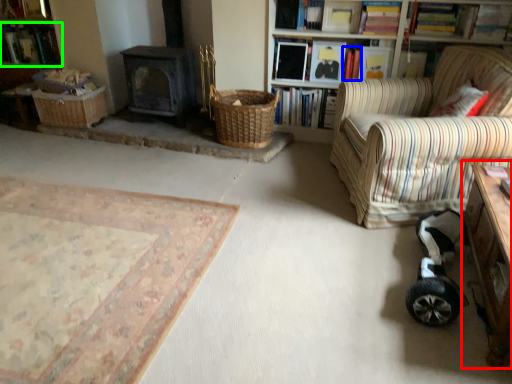
Question: Estimate the real-world distances between objects in this image. Which object is farther from table (highlighted by a red box), book (highlighted by a blue box) or book (highlighted by a green box)?

Choices:
 (A) book
 (B) book

Answer: (B)